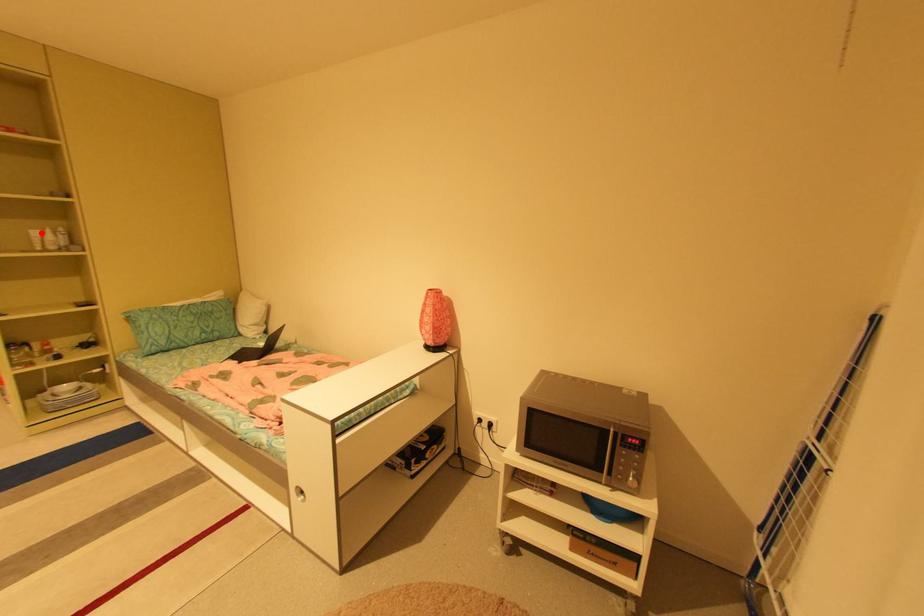
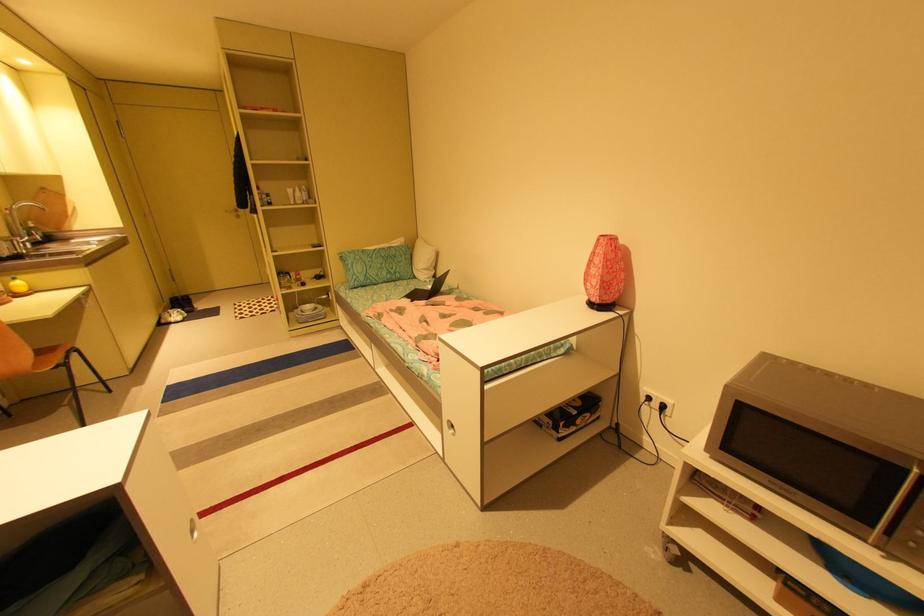
Question: I am providing you with two images of the same scene from different viewpoints. A red point is shown in image1. For the corresponding object point in image2, is it positioned nearer or farther from the camera?

Choices:
 (A) Nearer
 (B) Farther

Answer: (A)